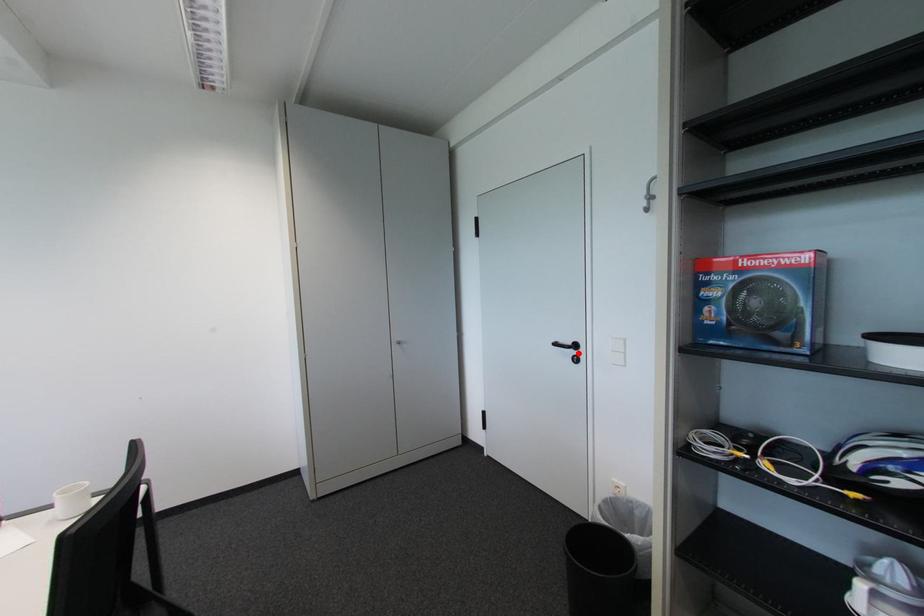
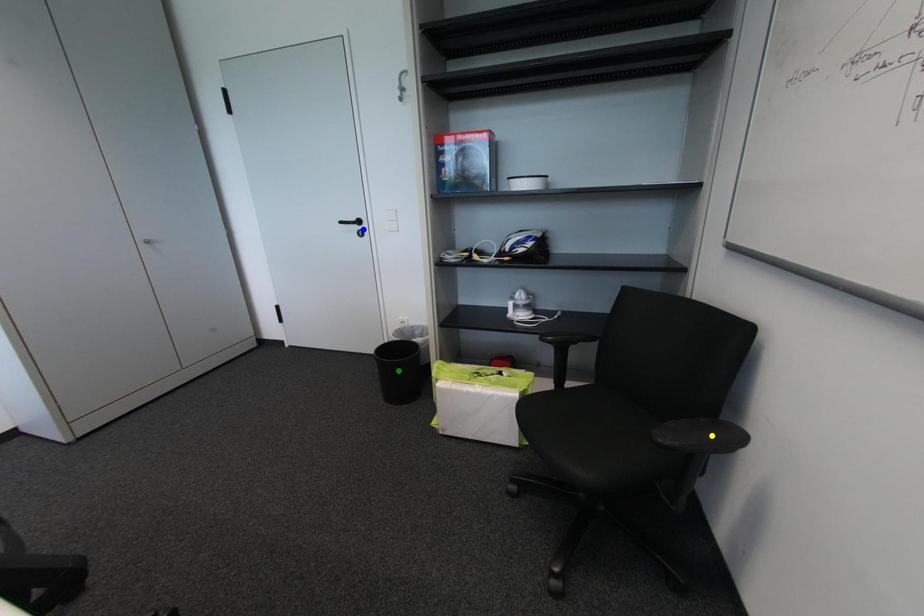
Question: I am providing you with two images of the same scene from different viewpoints. A red point is marked on the first image. You are given multiple points on the second image. In image 2, which mark is for the same physical point as the one in image 1?

Choices:
 (A) yellow point
 (B) green point
 (C) blue point

Answer: (C)